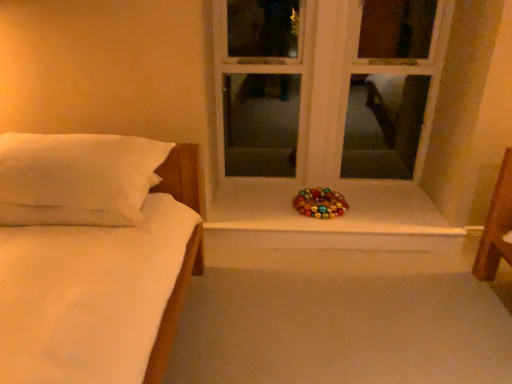
Question: From the image's perspective, is metallic shiny wreath at center located above white wood window at center?

Choices:
 (A) yes
 (B) no

Answer: (B)

Question: Does metallic shiny wreath at center come behind white wood window at center?

Choices:
 (A) no
 (B) yes

Answer: (B)

Question: Is metallic shiny wreath at center to the left of white wood window at center from the viewer's perspective?

Choices:
 (A) yes
 (B) no

Answer: (B)

Question: Would you say metallic shiny wreath at center is a long distance from white wood window at center?

Choices:
 (A) no
 (B) yes

Answer: (A)

Question: Is metallic shiny wreath at center positioned in front of white wood window at center?

Choices:
 (A) yes
 (B) no

Answer: (B)

Question: Is metallic shiny wreath at center looking in the opposite direction of white wood window at center?

Choices:
 (A) no
 (B) yes

Answer: (B)

Question: Can you confirm if white wood window at center is bigger than white soft pillow at left?

Choices:
 (A) yes
 (B) no

Answer: (A)

Question: Does white wood window at center have a lesser width compared to white soft pillow at left?

Choices:
 (A) yes
 (B) no

Answer: (A)

Question: Can you confirm if white wood window at center is taller than white soft pillow at left?

Choices:
 (A) no
 (B) yes

Answer: (B)

Question: Is white wood window at center looking in the opposite direction of white soft pillow at left?

Choices:
 (A) yes
 (B) no

Answer: (B)

Question: Would you say white wood window at center contains white soft pillow at left?

Choices:
 (A) yes
 (B) no

Answer: (B)

Question: Is white wood window at center far away from white soft pillow at left?

Choices:
 (A) yes
 (B) no

Answer: (A)

Question: Can you confirm if white wood window at center is bigger than metallic shiny wreath at center?

Choices:
 (A) yes
 (B) no

Answer: (A)